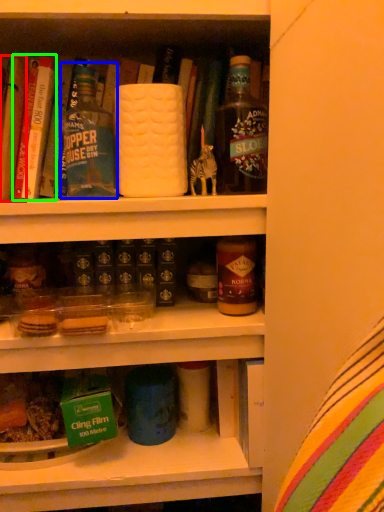
Question: Based on their relative distances, which object is nearer to book (highlighted by a red box)? Choose from bottle (highlighted by a blue box) and book (highlighted by a green box).

Choices:
 (A) bottle
 (B) book

Answer: (B)